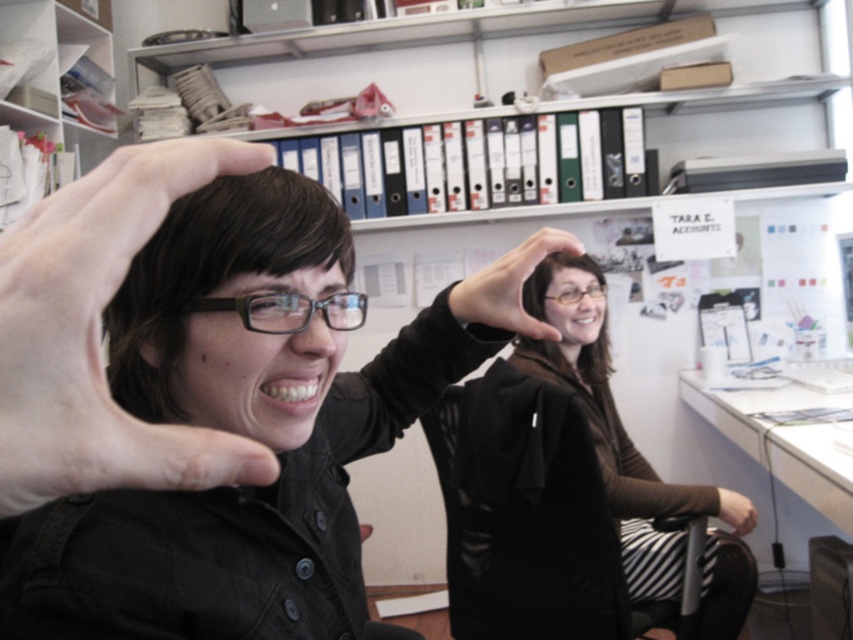
Question: Which point is closer to the camera?

Choices:
 (A) (561, 294)
 (B) (560, 259)

Answer: (A)

Question: Can you confirm if matte black hand at lower right is positioned to the left of clear plastic glasses at center?

Choices:
 (A) yes
 (B) no

Answer: (B)

Question: Is matte black shirt at center closer to the viewer compared to brownsmoothhair at center?

Choices:
 (A) yes
 (B) no

Answer: (A)

Question: Does brown textured sweater at center appear on the right side of black matte hand at center?

Choices:
 (A) no
 (B) yes

Answer: (B)

Question: Based on their relative distances, which object is farther from the matte black shirt at center?

Choices:
 (A) skinny white hand at left
 (B) black matte hand at center
 (C) brown textured sweater at center

Answer: (C)

Question: Which object is the closest to the skinny white hand at left?

Choices:
 (A) matte black hand at lower right
 (B) black matte hand at center
 (C) brown textured sweater at center

Answer: (B)